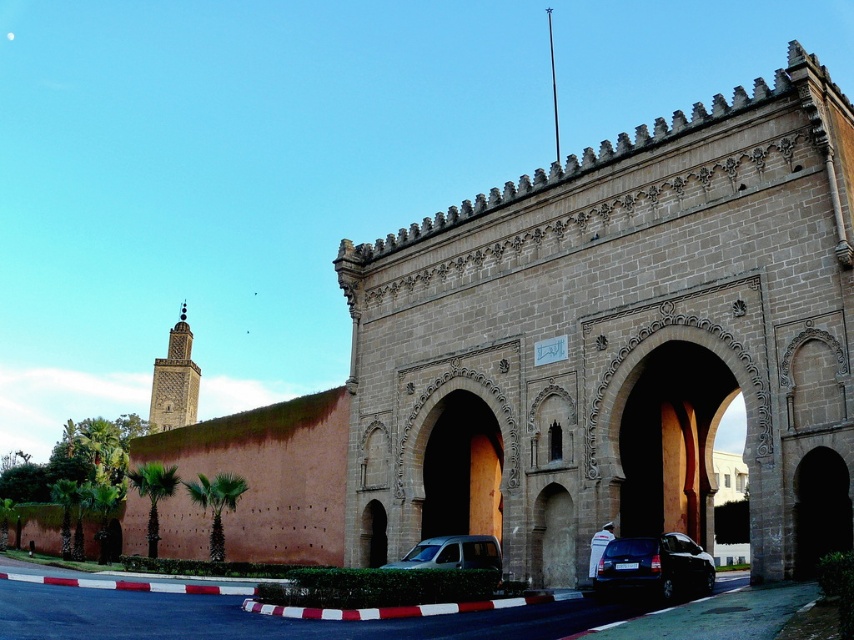
Is brown stone archway at center to the left of shiny black sedan at lower center from the viewer's perspective?

Yes, brown stone archway at center is to the left of shiny black sedan at lower center.

Does point (829, 145) lie behind point (617, 582)?

Yes, it is behind point (617, 582).

I want to click on brown stone archway at center, so click(x=600, y=349).

Is wooden archway at center positioned before metallic silver van at center?

Yes, wooden archway at center is closer to the viewer.

Does wooden archway at center have a lesser height compared to metallic silver van at center?

Incorrect, wooden archway at center's height does not fall short of metallic silver van at center's.

Measure the distance between point (x=656, y=371) and camera.

44.99 meters

Image resolution: width=854 pixels, height=640 pixels. I want to click on wooden archway at center, so click(670, 438).

Which is below, wooden archway at center or dark brown stone minaret at upper left?

Positioned lower is dark brown stone minaret at upper left.

Who is taller, wooden archway at center or dark brown stone minaret at upper left?

Standing taller between the two is dark brown stone minaret at upper left.

Is point (757, 396) positioned behind point (182, 308)?

No.

What are the coordinates of `wooden archway at center` in the screenshot? It's located at (670, 438).